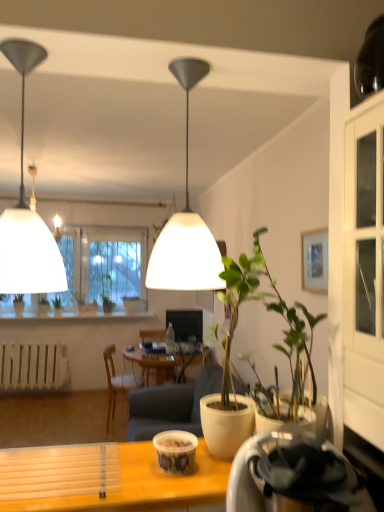
I want to click on free spot in front of matte plastic cup at center, so point(169,487).